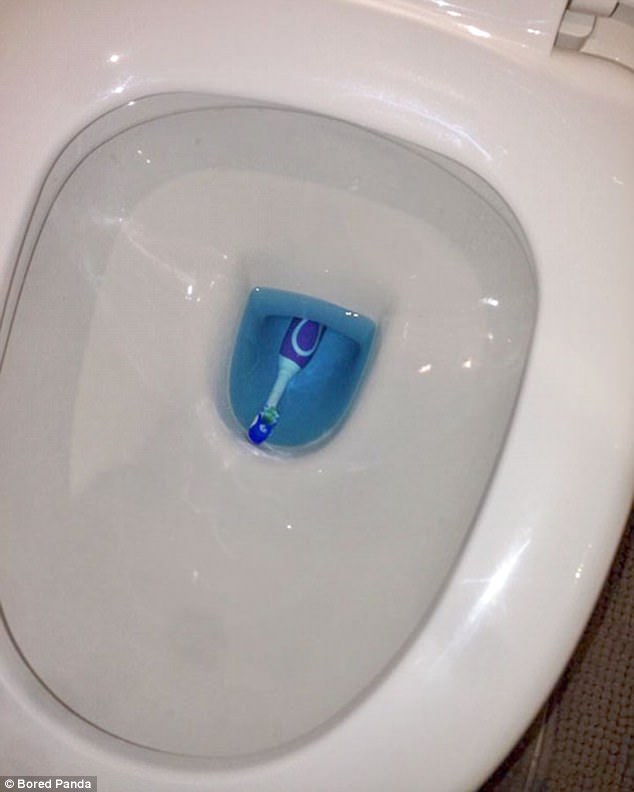
The image size is (634, 792). Identify the location of hinge. (586, 33).